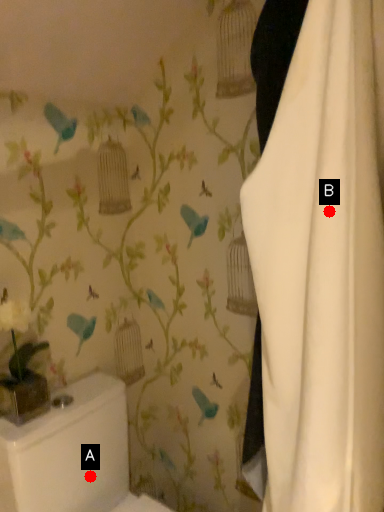
Question: Two points are circled on the image, labeled by A and B beside each circle. Which point appears closest to the camera in this image?

Choices:
 (A) A is closer
 (B) B is closer

Answer: (B)